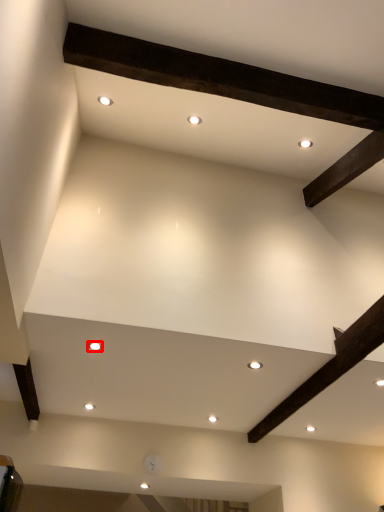
Question: From the image's perspective, what is the correct spatial positioning of lighting (annotated by the red box) in reference to lighting?

Choices:
 (A) below
 (B) above

Answer: (B)